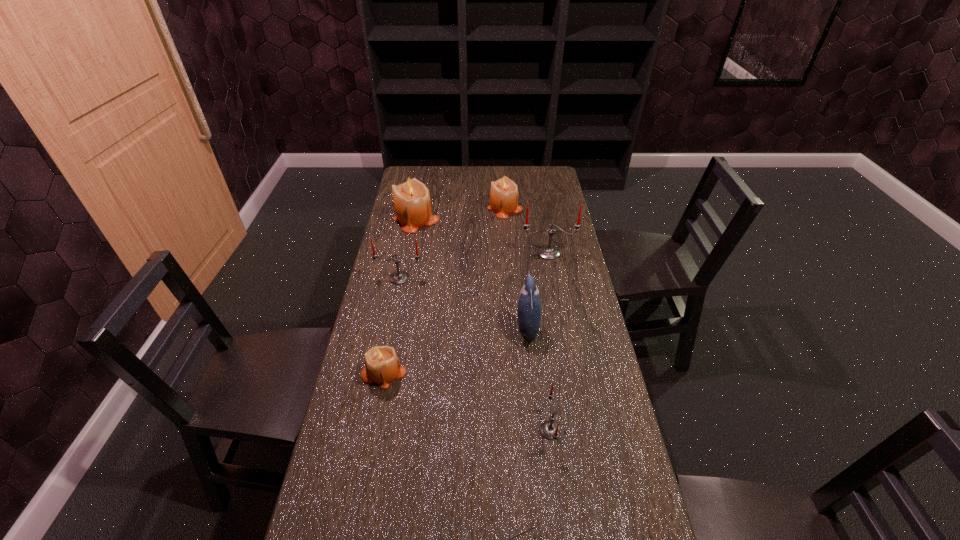
The height and width of the screenshot is (540, 960). I want to click on free space between the fourth nearest object and the seventh farthest object, so click(x=539, y=379).

Identify which object is the closest to the farthest red candle. Please provide its 2D coordinates. Your answer should be formatted as a tuple, i.e. [(x, y)], where the tuple contains the x and y coordinates of a point satisfying the conditions above.

[(504, 194)]

At what (x,y) coordinates should I click in order to perform the action: click on the closest object to the spectacles. Please return your answer as a coordinate pair (x, y). Looking at the image, I should click on (550, 430).

Identify the location of candle that is the fifth closest one to the nearest candle. The width and height of the screenshot is (960, 540). (504, 194).

Where is `the second closest candle to the fourth nearest object`? This screenshot has width=960, height=540. the second closest candle to the fourth nearest object is located at coordinates (548, 252).

The height and width of the screenshot is (540, 960). Find the location of `red candle that is the third closest to the nearest object`. red candle that is the third closest to the nearest object is located at coordinates (548, 252).

Select which red candle is the third closest to the nearest object. Please provide its 2D coordinates. Your answer should be formatted as a tuple, i.e. [(x, y)], where the tuple contains the x and y coordinates of a point satisfying the conditions above.

[(548, 252)]

This screenshot has width=960, height=540. In order to click on the third closest beige candle to the fifth farthest object in this screenshot , I will do `click(504, 194)`.

Identify which beige candle is the closest to the nearest beige candle. Please provide its 2D coordinates. Your answer should be formatted as a tuple, i.e. [(x, y)], where the tuple contains the x and y coordinates of a point satisfying the conditions above.

[(412, 205)]

What are the coordinates of `free region that satisfies the following two spatial constraints: 1. on the back side of the second smallest beige candle; 2. on the right side of the biggest beige candle` in the screenshot? It's located at (419, 207).